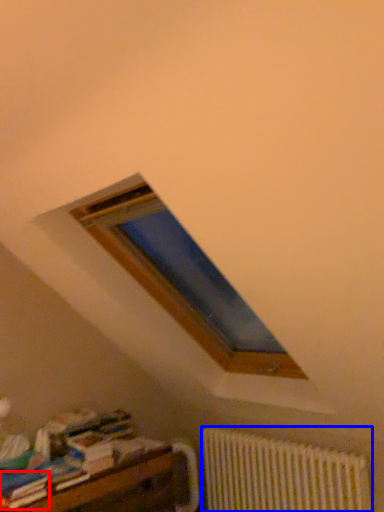
Question: Which object is further to the camera taking this photo, paperback book (highlighted by a red box) or radiator (highlighted by a blue box)?

Choices:
 (A) paperback book
 (B) radiator

Answer: (B)